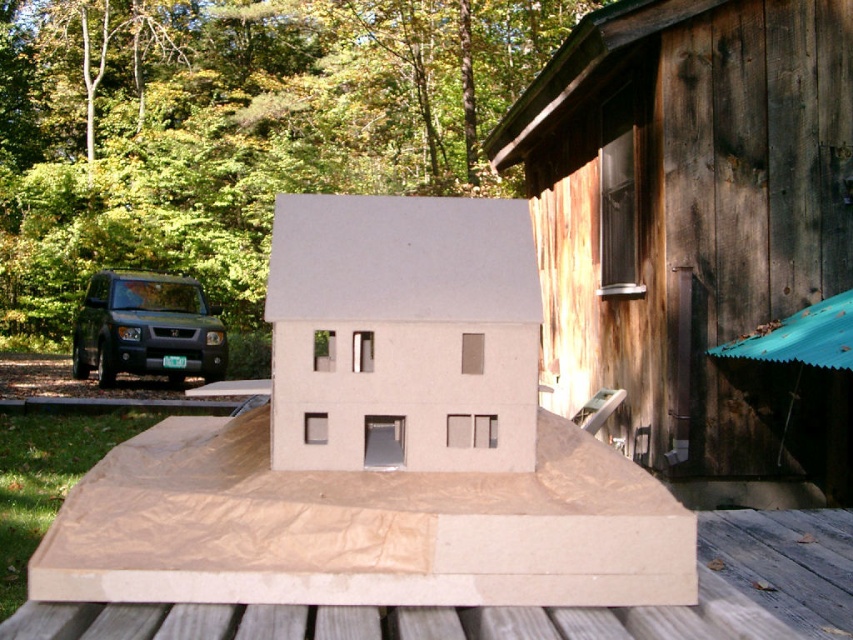
Question: Which object is farther from the camera taking this photo?

Choices:
 (A) white cardboard cabin at center
 (B) dark green matte suv at left

Answer: (B)

Question: Can you confirm if weathered wood hut at right is thinner than white cardboard cabin at center?

Choices:
 (A) yes
 (B) no

Answer: (B)

Question: Which object is the closest to the white cardboard cabin at center?

Choices:
 (A) weathered wood hut at right
 (B) dark green matte suv at left

Answer: (A)

Question: Is weathered wood hut at right above dark green matte suv at left?

Choices:
 (A) no
 (B) yes

Answer: (B)

Question: Based on their relative distances, which object is farther from the white cardboard cabin at center?

Choices:
 (A) dark green matte suv at left
 (B) weathered wood hut at right

Answer: (A)

Question: Is white cardboard cabin at center closer to the viewer compared to dark green matte suv at left?

Choices:
 (A) no
 (B) yes

Answer: (B)